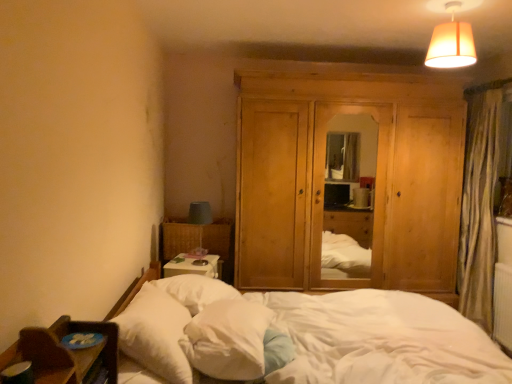
Question: Is the position of white soft bed at lower left less distant than that of white soft pillow at center, the first pillow when ordered from right to left?

Choices:
 (A) no
 (B) yes

Answer: (B)

Question: Does white soft bed at lower left appear on the right side of white soft pillow at center, the second pillow when ordered from left to right?

Choices:
 (A) no
 (B) yes

Answer: (B)

Question: Is white soft pillow at center, the first pillow when ordered from right to left, inside white soft bed at lower left?

Choices:
 (A) yes
 (B) no

Answer: (A)

Question: Can you confirm if white soft bed at lower left is taller than white soft pillow at center, the first pillow when ordered from right to left?

Choices:
 (A) no
 (B) yes

Answer: (B)

Question: Is white soft bed at lower left next to white soft pillow at center, the first pillow when ordered from right to left?

Choices:
 (A) yes
 (B) no

Answer: (B)

Question: Is white soft bed at lower left shorter than white soft pillow at center, the second pillow when ordered from left to right?

Choices:
 (A) no
 (B) yes

Answer: (A)

Question: Is white soft pillow at center, the first pillow when ordered from right to left, thinner than matte beige lampshade at upper right?

Choices:
 (A) yes
 (B) no

Answer: (B)

Question: Does white soft pillow at center, the first pillow when ordered from right to left, lie in front of matte beige lampshade at upper right?

Choices:
 (A) no
 (B) yes

Answer: (B)

Question: Is there a large distance between white soft pillow at center, the second pillow when ordered from left to right, and matte beige lampshade at upper right?

Choices:
 (A) yes
 (B) no

Answer: (A)

Question: Can you confirm if white soft pillow at center, the first pillow when ordered from right to left, is positioned to the right of matte beige lampshade at upper right?

Choices:
 (A) no
 (B) yes

Answer: (A)

Question: Would you say white soft pillow at center, the first pillow when ordered from right to left, contains matte beige lampshade at upper right?

Choices:
 (A) no
 (B) yes

Answer: (A)

Question: Can you confirm if white soft pillow at center, the second pillow when ordered from left to right, is wider than matte beige lampshade at upper right?

Choices:
 (A) yes
 (B) no

Answer: (A)

Question: Does natural wood dresser at center turn towards white soft pillow at lower left, which ranks as the second pillow in right-to-left order?

Choices:
 (A) no
 (B) yes

Answer: (B)